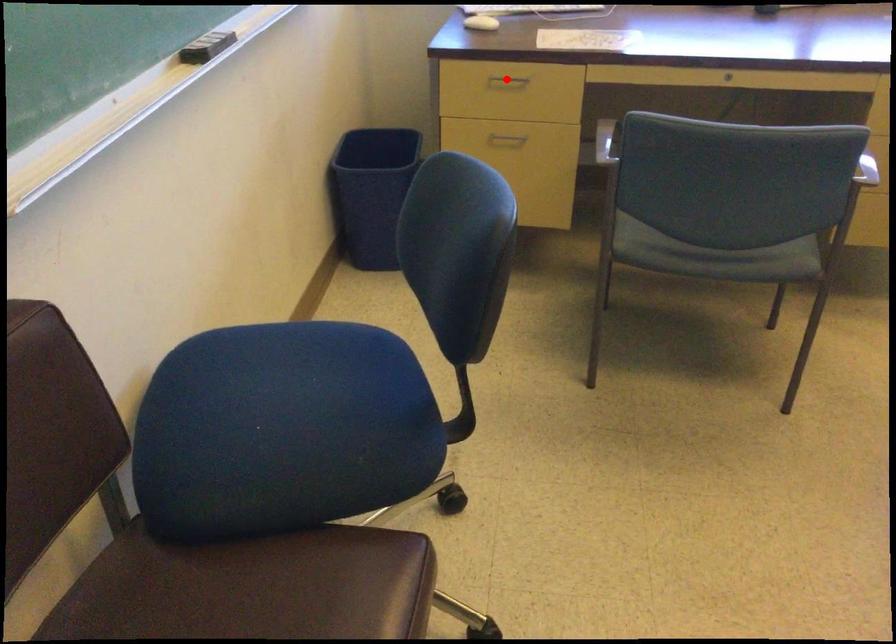
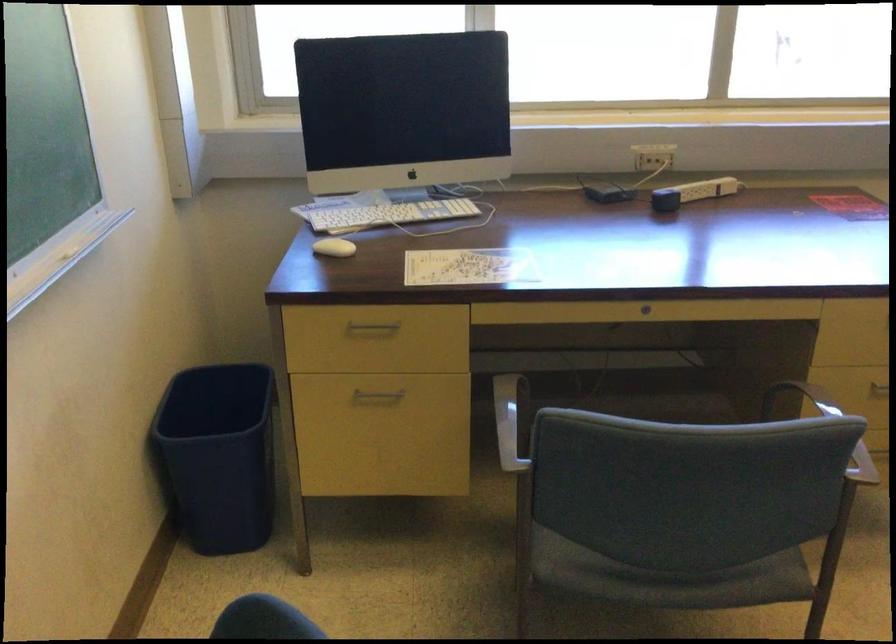
Locate, in the second image, the point that corresponds to the highlighted location in the first image.

(373, 327)